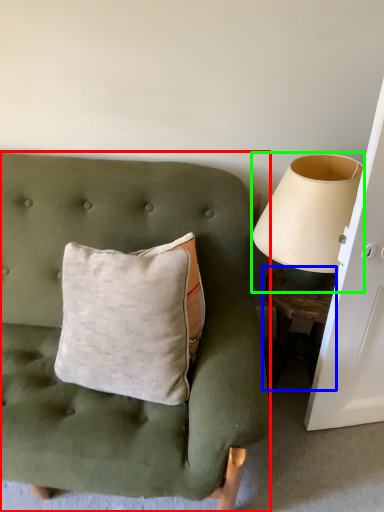
Question: Based on their relative distances, which object is farther from furniture (highlighted by a red box)? Choose from table (highlighted by a blue box) and table lamp (highlighted by a green box).

Choices:
 (A) table
 (B) table lamp

Answer: (A)